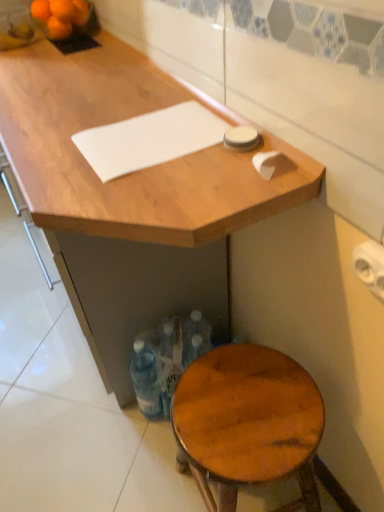
This screenshot has height=512, width=384. Identify the location of vacant space situated on the left part of wooden stool at lower right. (140, 470).